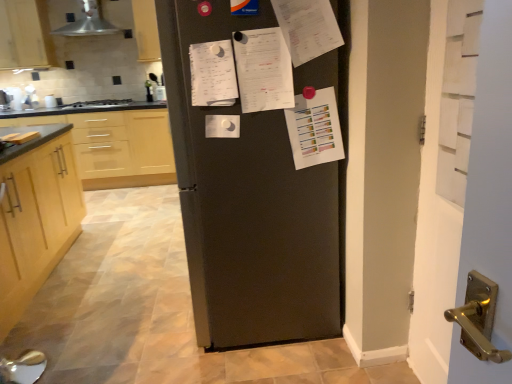
Question: From the image's perspective, is white paper at center, which appears as the 1th list when viewed from the right, above white painted wood door at right?

Choices:
 (A) yes
 (B) no

Answer: (A)

Question: From the image's perspective, is white paper at center, placed as the second list when sorted from left to right, below white painted wood door at right?

Choices:
 (A) no
 (B) yes

Answer: (A)

Question: From a real-world perspective, is white paper at center, placed as the second list when sorted from left to right, located beneath white painted wood door at right?

Choices:
 (A) yes
 (B) no

Answer: (B)

Question: Considering the relative sizes of white paper at center, which appears as the 1th list when viewed from the right, and white painted wood door at right in the image provided, is white paper at center, which appears as the 1th list when viewed from the right, wider than white painted wood door at right?

Choices:
 (A) no
 (B) yes

Answer: (A)

Question: Is white painted wood door at right a part of white paper at center, placed as the second list when sorted from left to right?

Choices:
 (A) yes
 (B) no

Answer: (B)

Question: Is white paper at center, placed as the second list when sorted from left to right, at the right side of white painted wood door at right?

Choices:
 (A) yes
 (B) no

Answer: (B)

Question: Could you tell me if white paper at upper right is turned towards light wood cabinet at left, arranged as the 3th cabinetry when viewed from the top?

Choices:
 (A) no
 (B) yes

Answer: (A)

Question: Is white paper at upper right outside light wood cabinet at left, the first cabinetry from the front?

Choices:
 (A) no
 (B) yes

Answer: (B)

Question: Can you confirm if white paper at upper right is bigger than light wood cabinet at left, the first cabinetry from the front?

Choices:
 (A) yes
 (B) no

Answer: (B)

Question: From the image's perspective, is white paper at upper right located above light wood cabinet at left, the 1th cabinetry positioned from the bottom?

Choices:
 (A) yes
 (B) no

Answer: (A)

Question: Is the depth of white paper at upper right less than that of light wood cabinet at left, which is counted as the third cabinetry, starting from the back?

Choices:
 (A) no
 (B) yes

Answer: (B)

Question: Is white paper at upper right positioned with its back to light wood cabinet at left, arranged as the 3th cabinetry when viewed from the top?

Choices:
 (A) yes
 (B) no

Answer: (B)

Question: Does metallic silver exhaust hood at upper left have a lesser height compared to white painted wood door at right?

Choices:
 (A) yes
 (B) no

Answer: (A)